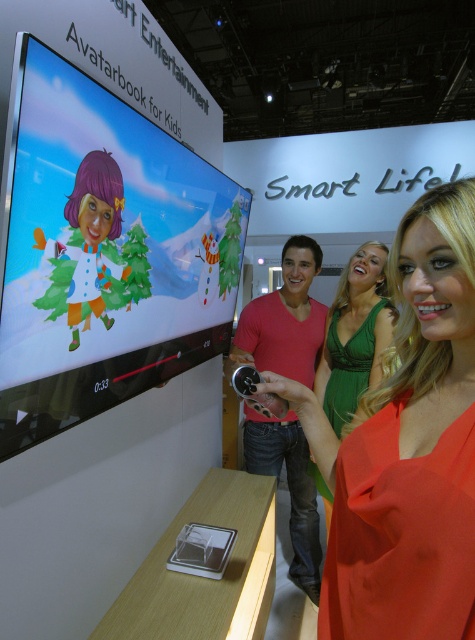
Can you confirm if matte red shirt at center is positioned to the right of green satin dress at center?

No, matte red shirt at center is not to the right of green satin dress at center.

Find the location of a particular element. matte red shirt at center is located at coordinates (285, 317).

Between point (366, 422) and point (300, 531), which one is positioned behind?

Positioned behind is point (300, 531).

Is point (428, 532) closer to camera compared to point (317, 317)?

Yes, point (428, 532) is closer to viewer.

Locate an element on the screen. The height and width of the screenshot is (640, 475). orange satin dress at center is located at coordinates (407, 448).

At what (x,y) coordinates should I click in order to perform the action: click on orange satin dress at center. Please return your answer as a coordinate pair (x, y). This screenshot has height=640, width=475. Looking at the image, I should click on (407, 448).

Does point (456, 499) lie in front of point (345, 288)?

Yes.

Who is more forward, [415,330] or [340,435]?

Point [415,330] is more forward.

Is point (406, 627) positioned before point (342, 385)?

Yes, point (406, 627) is closer to viewer.

Image resolution: width=475 pixels, height=640 pixels. What are the coordinates of `orange satin dress at center` in the screenshot? It's located at (407, 448).